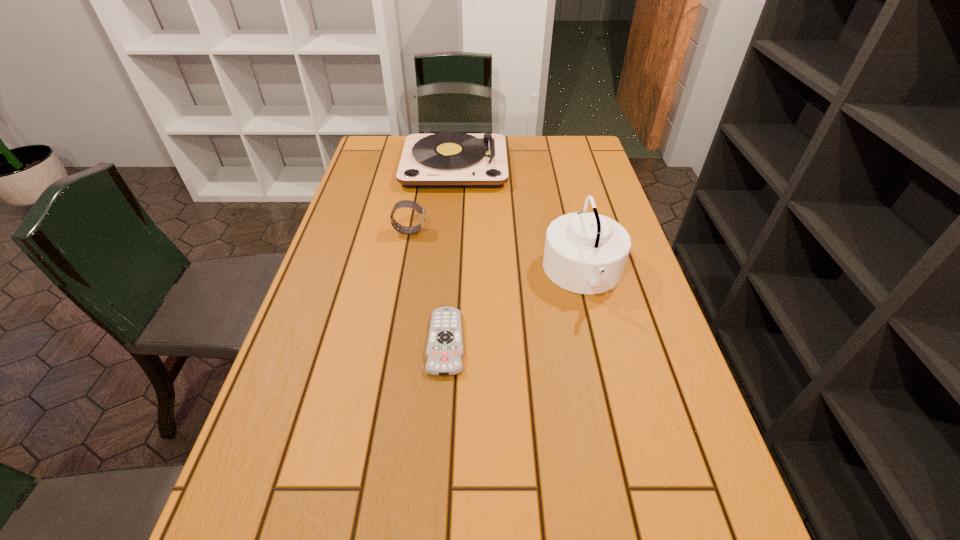
Image resolution: width=960 pixels, height=540 pixels. I want to click on the farthest object, so click(450, 159).

Find the location of a particular element. The image size is (960, 540). record player is located at coordinates tap(450, 159).

This screenshot has width=960, height=540. I want to click on kettle, so click(x=586, y=253).

Find the location of `the second tallest object`. the second tallest object is located at coordinates (586, 253).

Locate an element on the screen. watch is located at coordinates (404, 203).

The height and width of the screenshot is (540, 960). In order to click on the second shortest object in this screenshot , I will do tap(404, 203).

Find the location of `the shortest object`. the shortest object is located at coordinates (444, 352).

At what (x,y) coordinates should I click in order to perform the action: click on blank area located 0.190m with the tonearm facing the front of the farthest object. Please return your answer as a coordinate pair (x, y). Looking at the image, I should click on (449, 230).

At what (x,y) coordinates should I click in order to perform the action: click on free space located 0.090m on the spout of the rightmost object. Please return your answer as a coordinate pair (x, y). The width and height of the screenshot is (960, 540). Looking at the image, I should click on (507, 274).

Where is `free location located 0.280m on the spout of the rightmost object`? The width and height of the screenshot is (960, 540). free location located 0.280m on the spout of the rightmost object is located at coordinates (428, 274).